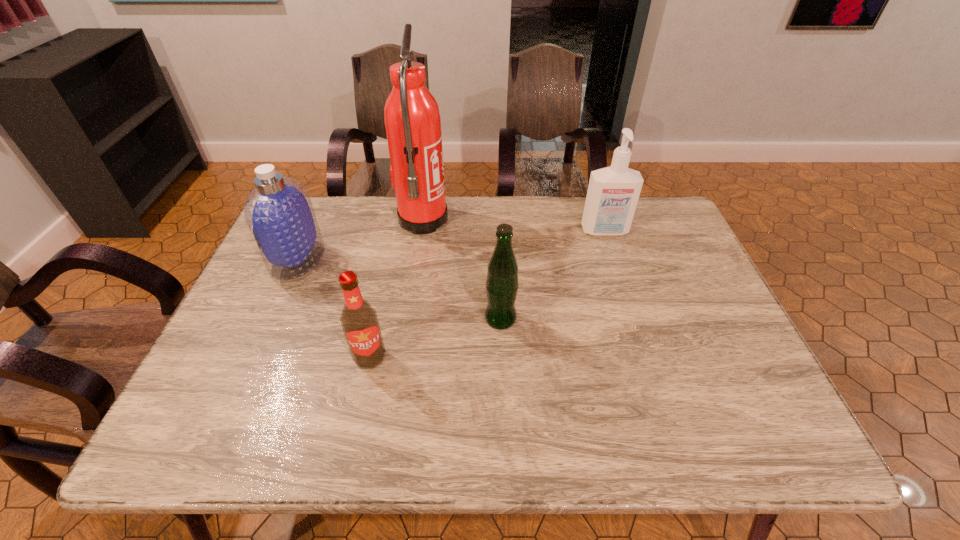
The height and width of the screenshot is (540, 960). In order to click on empty space that is in between the left cleansing agent and the farther beer bottle in this screenshot , I will do `click(399, 289)`.

Identify the location of blank region between the left beer bottle and the farther beer bottle. The image size is (960, 540). (435, 338).

Where is `vacant space that's between the leftmost object and the right beer bottle`? The image size is (960, 540). vacant space that's between the leftmost object and the right beer bottle is located at coordinates (399, 289).

This screenshot has width=960, height=540. I want to click on free space between the left cleansing agent and the nearest object, so click(x=334, y=308).

Where is `vacant point located between the right beer bottle and the left cleansing agent`? The width and height of the screenshot is (960, 540). vacant point located between the right beer bottle and the left cleansing agent is located at coordinates (399, 289).

This screenshot has height=540, width=960. What are the coordinates of `free space between the right cleansing agent and the left cleansing agent` in the screenshot? It's located at (451, 246).

Find the location of `free spot between the nearer beer bottle and the tallest object`. free spot between the nearer beer bottle and the tallest object is located at coordinates (396, 289).

Locate an element on the screen. vacant area that lies between the leftmost object and the right beer bottle is located at coordinates (399, 289).

The image size is (960, 540). In order to click on unoccupied position between the tallest object and the left beer bottle in this screenshot , I will do `click(396, 289)`.

The width and height of the screenshot is (960, 540). I want to click on free space between the left cleansing agent and the tallest object, so pos(360,240).